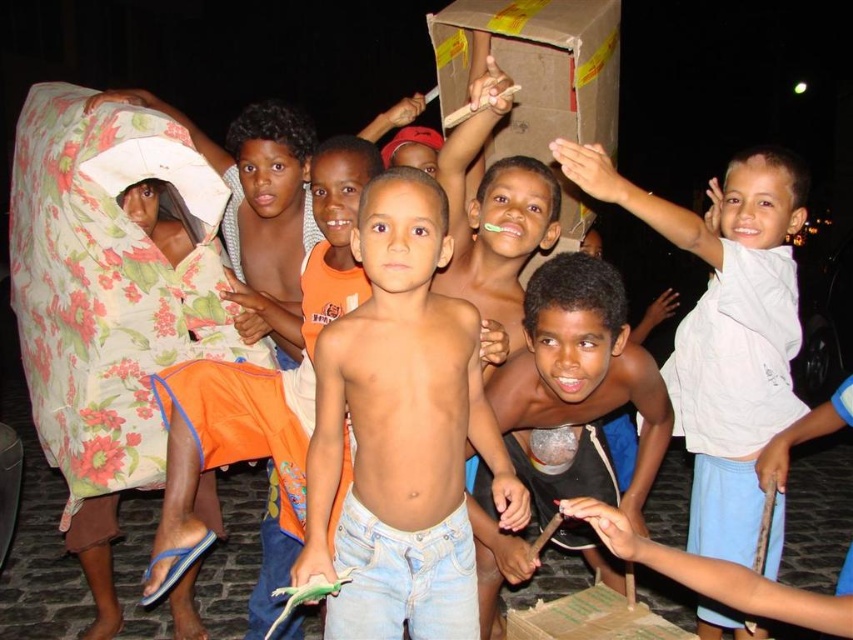
Question: Among these objects, which one is nearest to the camera?

Choices:
 (A) shiny metallic cup at center
 (B) cardboard box at center
 (C) white cotton shirt at upper right

Answer: (A)

Question: Is shiny metallic cup at center closer to the viewer compared to cardboard box at center?

Choices:
 (A) yes
 (B) no

Answer: (A)

Question: Is light blue denim jeans at center smaller than cardboard box at center?

Choices:
 (A) no
 (B) yes

Answer: (A)

Question: Is white cotton shirt at upper right to the right of shiny metallic cup at center from the viewer's perspective?

Choices:
 (A) yes
 (B) no

Answer: (A)

Question: Among these points, which one is farthest from the camera?

Choices:
 (A) (689, 230)
 (B) (502, 560)
 (C) (461, 333)
 (D) (521, 625)

Answer: (D)

Question: Which point appears closest to the camera in this image?

Choices:
 (A) (608, 605)
 (B) (541, 378)
 (C) (422, 280)

Answer: (C)